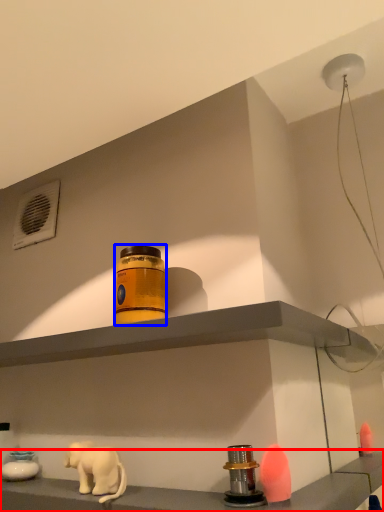
Question: Which of the following is the closest to the observer, shelf (highlighted by a red box) or bottle (highlighted by a blue box)?

Choices:
 (A) shelf
 (B) bottle

Answer: (A)